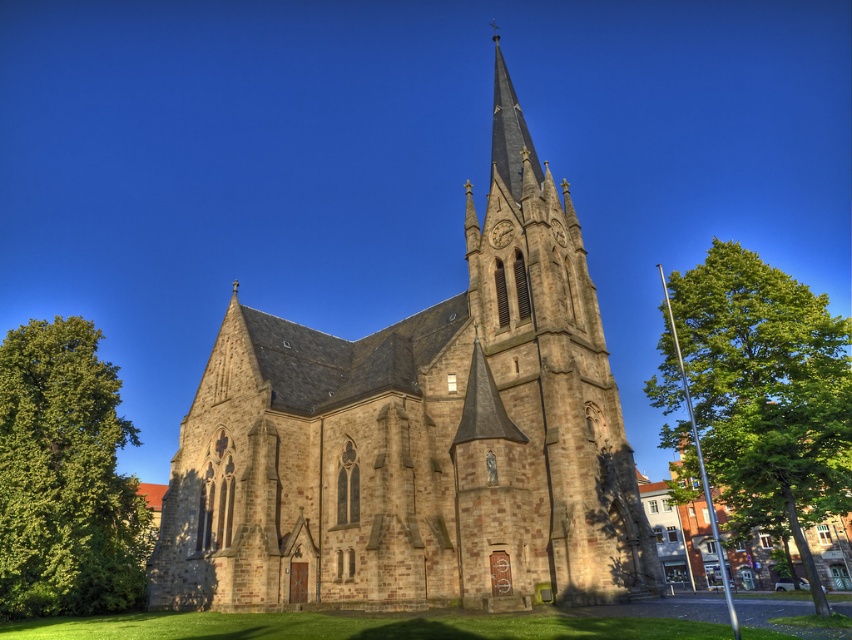
Is brown stone church at center to the left of green leafy tree at right from the viewer's perspective?

Indeed, brown stone church at center is positioned on the left side of green leafy tree at right.

You are a GUI agent. You are given a task and a screenshot of the screen. Output one action in this format:
    pyautogui.click(x=<x>, y=<y>)
    Task: Click on the brown stone church at center
    This screenshot has width=852, height=640.
    Given the screenshot: What is the action you would take?
    pyautogui.click(x=418, y=438)

This screenshot has height=640, width=852. What do you see at coordinates (418, 438) in the screenshot?
I see `brown stone church at center` at bounding box center [418, 438].

Is brown stone church at center taller than green leafy tree at left?

Yes.

Where is `brown stone church at center`? This screenshot has width=852, height=640. brown stone church at center is located at coordinates (418, 438).

Is green leafy tree at right below green leafy tree at left?

Indeed, green leafy tree at right is positioned under green leafy tree at left.

Between point (799, 524) and point (85, 355), which one is positioned behind?

Positioned behind is point (85, 355).

Who is more distant from viewer, (786, 282) or (85, 500)?

Positioned behind is point (85, 500).

Find the location of a particular element. green leafy tree at right is located at coordinates (763, 394).